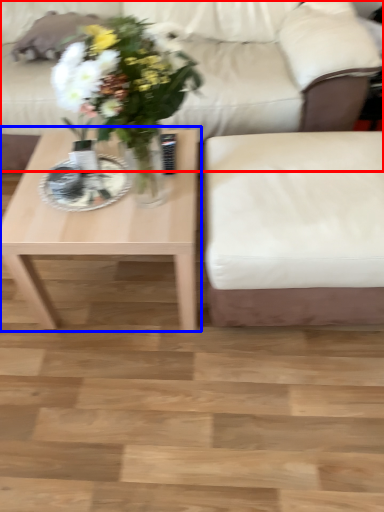
Question: Among these objects, which one is nearest to the camera, studio couch (highlighted by a red box) or coffee table (highlighted by a blue box)?

Choices:
 (A) studio couch
 (B) coffee table

Answer: (B)